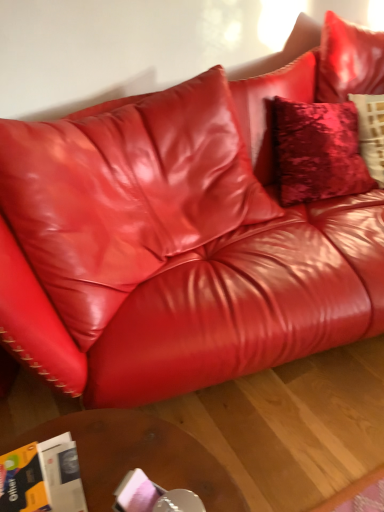
Locate an element on the screen. The height and width of the screenshot is (512, 384). free point above brown wooden table at lower center (from a real-world perspective) is located at coordinates (135, 453).